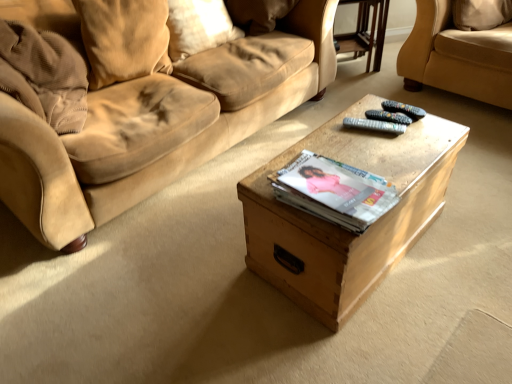
Find the location of `free space that is to the left of wooden box at center`. free space that is to the left of wooden box at center is located at coordinates (195, 263).